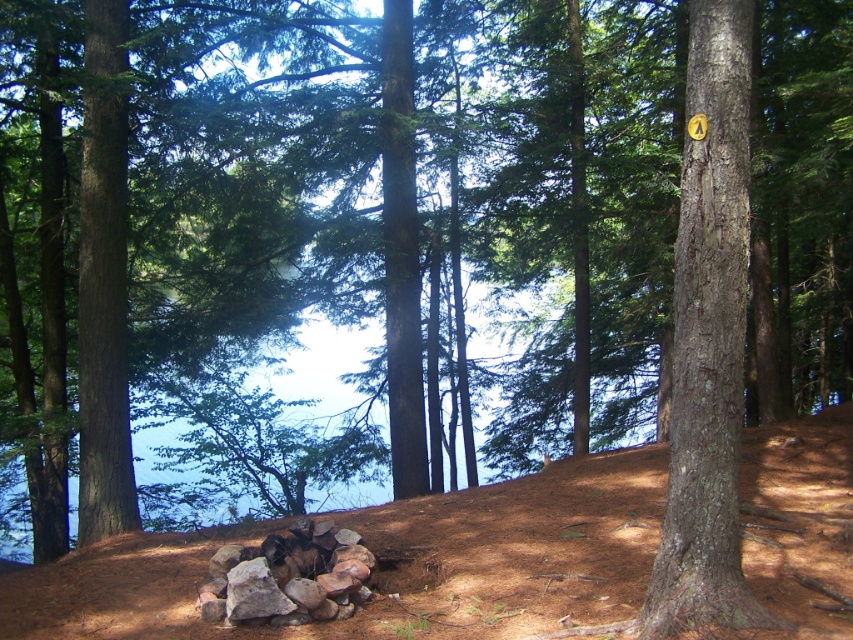
Question: Does smooth brown tree trunk at right have a lesser width compared to rusty metallic rocks at center?

Choices:
 (A) yes
 (B) no

Answer: (A)

Question: Estimate the real-world distances between objects in this image. Which object is farther from the rusty metallic rocks at center?

Choices:
 (A) brown dirt hillside at center
 (B) smooth brown tree trunk at right

Answer: (B)

Question: Does smooth brown tree trunk at right have a smaller size compared to rusty metallic rocks at center?

Choices:
 (A) yes
 (B) no

Answer: (B)

Question: Considering the relative positions of brown dirt hillside at center and rusty metallic rocks at center in the image provided, where is brown dirt hillside at center located with respect to rusty metallic rocks at center?

Choices:
 (A) right
 (B) left

Answer: (A)

Question: Which object appears farthest from the camera in this image?

Choices:
 (A) brown dirt hillside at center
 (B) rusty metallic rocks at center

Answer: (B)

Question: Which object is closer to the camera taking this photo?

Choices:
 (A) smooth brown tree trunk at right
 (B) rusty metallic rocks at center
 (C) brown dirt hillside at center

Answer: (C)